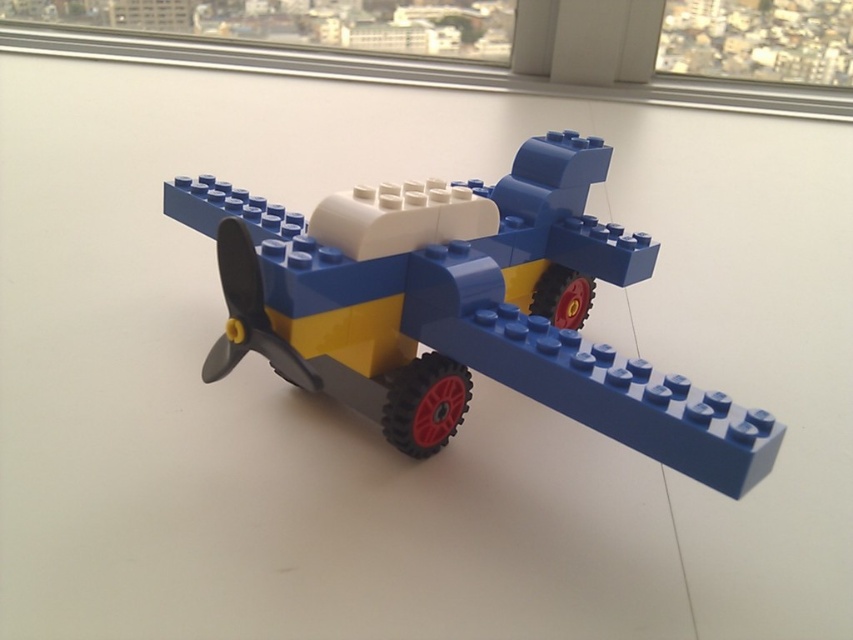
Question: Does blue plastic airplane at center appear under transparent glass window at upper right?

Choices:
 (A) yes
 (B) no

Answer: (A)

Question: Which of the following is the closest to the observer?

Choices:
 (A) transparent glass window at upper right
 (B) blue plastic airplane at center

Answer: (B)

Question: Can you confirm if blue plastic airplane at center is positioned above transparent glass window at upper right?

Choices:
 (A) no
 (B) yes

Answer: (A)

Question: Can you confirm if blue plastic airplane at center is positioned to the left of transparent glass window at upper right?

Choices:
 (A) no
 (B) yes

Answer: (B)

Question: Which object is closer to the camera taking this photo?

Choices:
 (A) transparent glass window at upper right
 (B) blue plastic airplane at center

Answer: (B)